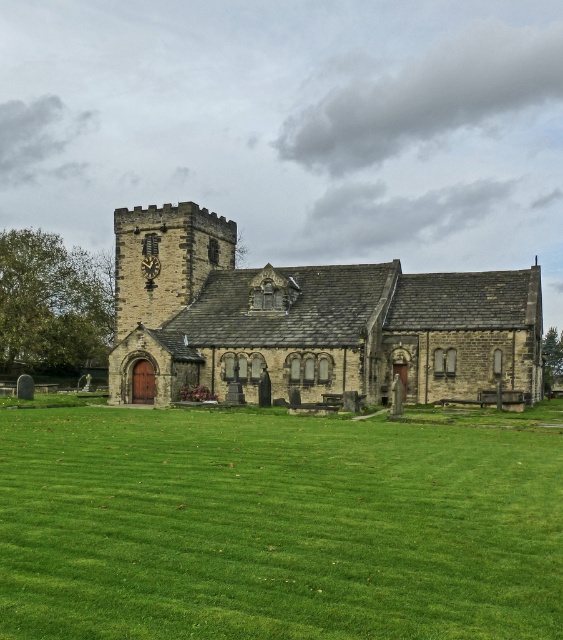
Question: Can you confirm if green grass at center is positioned below stone church at center?

Choices:
 (A) no
 (B) yes

Answer: (B)

Question: Where is green grass at center located in relation to stone church at center in the image?

Choices:
 (A) below
 (B) above

Answer: (A)

Question: Which point appears closest to the camera in this image?

Choices:
 (A) (185, 344)
 (B) (221, 438)

Answer: (B)

Question: Which object is farther from the camera taking this photo?

Choices:
 (A) green grass at center
 (B) stone church at center

Answer: (B)

Question: Observing the image, what is the correct spatial positioning of green grass at center in reference to stone church at center?

Choices:
 (A) above
 (B) below

Answer: (B)

Question: Which point is closer to the camera?

Choices:
 (A) green grass at center
 (B) stone church at center

Answer: (A)